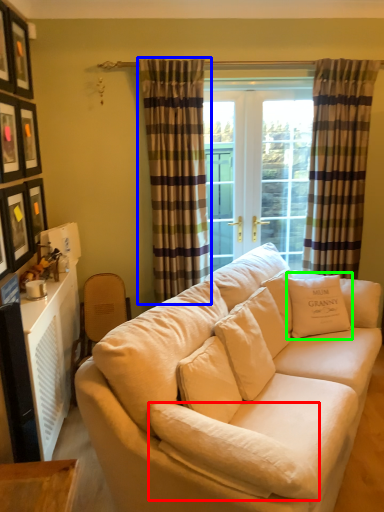
Question: Considering the real-world distances, which object is closest to pillow (highlighted by a red box)? curtain (highlighted by a blue box) or pillow (highlighted by a green box).

Choices:
 (A) curtain
 (B) pillow

Answer: (B)